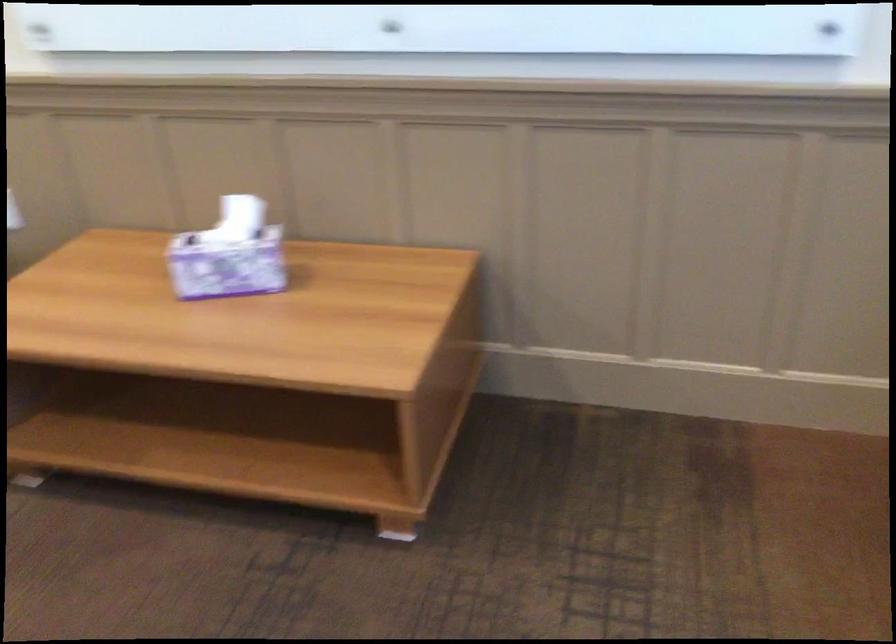
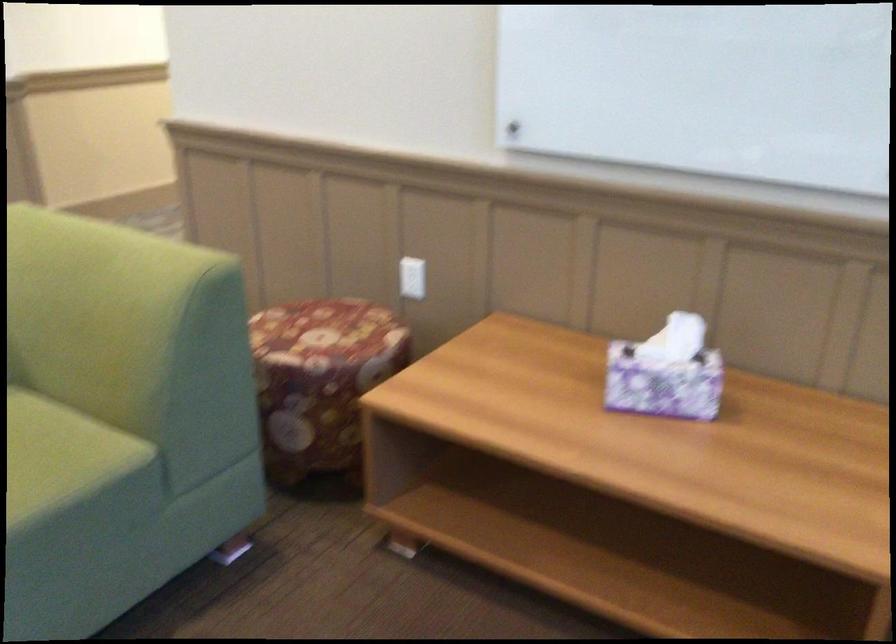
Question: The camera is either moving clockwise (left) or counter-clockwise (right) around the object. The first image is from the beginning of the video and the second image is from the end. Is the camera moving left or right when shooting the video?

Choices:
 (A) Left
 (B) Right

Answer: (B)